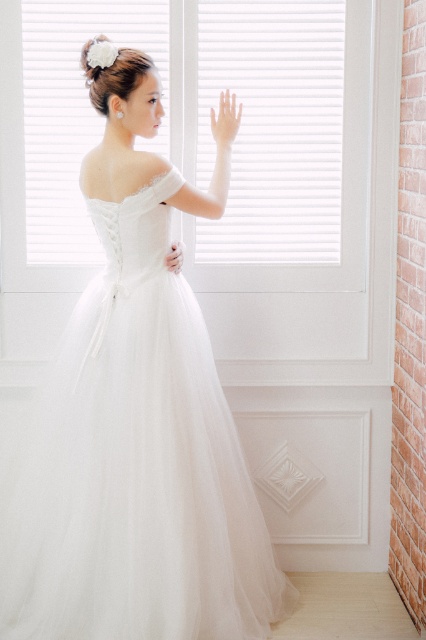
Which is more to the left, white tulle dress at center or white matte window at center?

Positioned to the left is white tulle dress at center.

Who is more forward, (x=140, y=388) or (x=288, y=100)?

Point (x=140, y=388) is more forward.

What are the coordinates of `white tulle dress at center` in the screenshot? It's located at (137, 424).

Can you confirm if white matte window at center is bigger than white satin hand at center?

Indeed, white matte window at center has a larger size compared to white satin hand at center.

Who is positioned more to the right, white matte window at center or white satin hand at center?

white matte window at center is more to the right.

I want to click on white matte window at center, so click(273, 128).

Find the location of `white matte window at center`. white matte window at center is located at coordinates (273, 128).

Which of these two, white tulle dress at center or white satin hand at center, stands taller?

Standing taller between the two is white tulle dress at center.

Is white tulle dress at center wider than white satin hand at center?

Yes, white tulle dress at center is wider than white satin hand at center.

In the scene shown: Who is more forward, (111, 172) or (181, 266)?

Point (111, 172) is more forward.

This screenshot has width=426, height=640. I want to click on white tulle dress at center, so click(x=137, y=424).